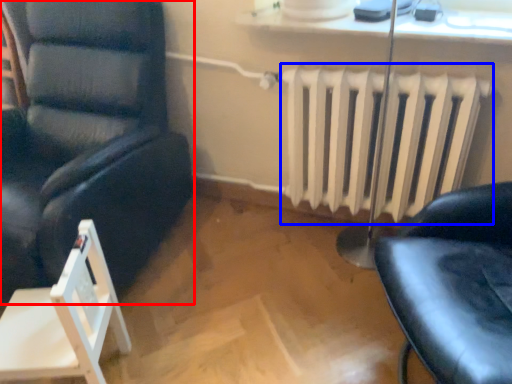
Question: Which object appears farthest to the camera in this image, chair (highlighted by a red box) or radiator (highlighted by a blue box)?

Choices:
 (A) chair
 (B) radiator

Answer: (B)